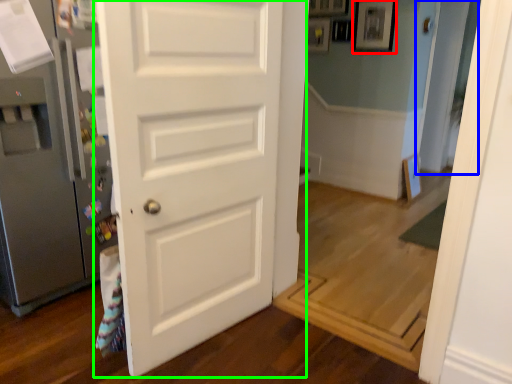
Question: Estimate the real-world distances between objects in this image. Which object is farther from picture frame (highlighted by a red box), glass door (highlighted by a blue box) or door (highlighted by a green box)?

Choices:
 (A) glass door
 (B) door

Answer: (B)